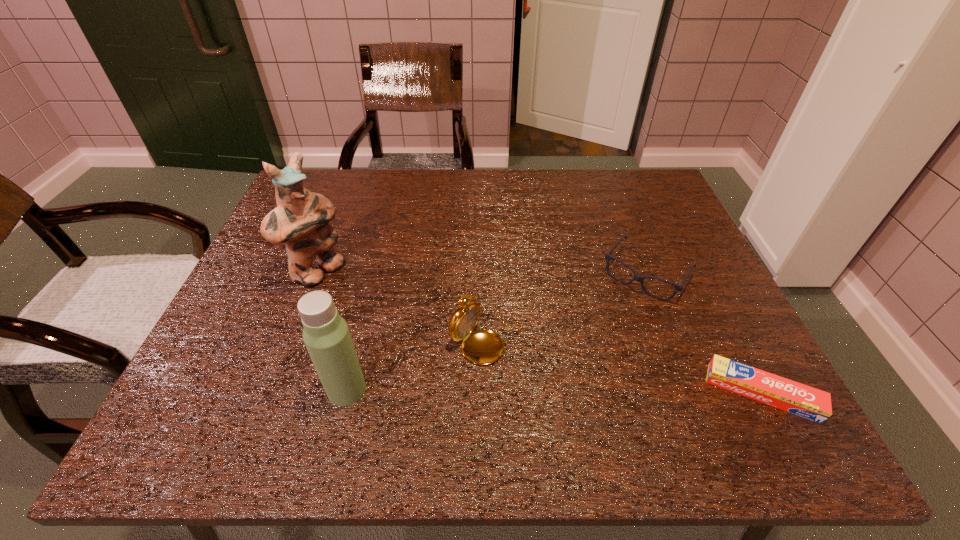
This screenshot has width=960, height=540. I want to click on object that is the closest to the toothpaste, so pyautogui.click(x=638, y=278).

Find the location of `free space that satisfies the following two spatial constraints: 1. on the front side of the second tallest object; 2. on the left side of the tallest object`. free space that satisfies the following two spatial constraints: 1. on the front side of the second tallest object; 2. on the left side of the tallest object is located at coordinates (272, 390).

Find the location of `free space that satisfies the following two spatial constraints: 1. on the back side of the second object from left to right; 2. on the left side of the spectacles`. free space that satisfies the following two spatial constraints: 1. on the back side of the second object from left to right; 2. on the left side of the spectacles is located at coordinates (375, 273).